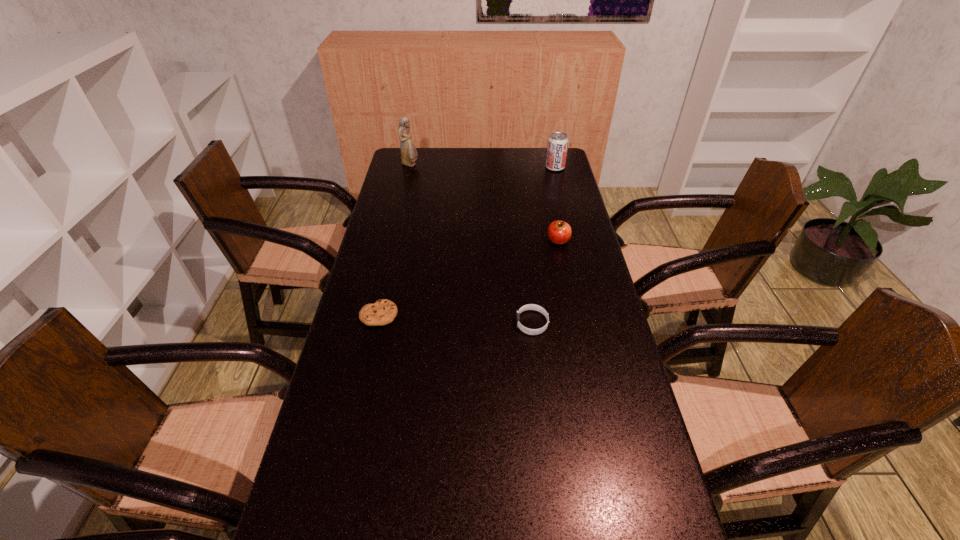
Identify the location of free spot between the cookie and the third tallest object. (468, 278).

The height and width of the screenshot is (540, 960). Find the location of `free area in between the third nearest object and the fourth shortest object`. free area in between the third nearest object and the fourth shortest object is located at coordinates (557, 204).

The height and width of the screenshot is (540, 960). In order to click on vacant point located between the second shortest object and the second tallest object in this screenshot , I will do `click(543, 245)`.

In order to click on free spot between the shortest object and the figurine in this screenshot , I will do `click(395, 240)`.

At what (x,y) coordinates should I click in order to perform the action: click on free spot between the tallest object and the cookie. Please return your answer as a coordinate pair (x, y). Looking at the image, I should click on (395, 240).

At what (x,y) coordinates should I click in order to perform the action: click on object that ranks as the second closest to the second shortest object. Please return your answer as a coordinate pair (x, y). This screenshot has width=960, height=540. Looking at the image, I should click on (382, 312).

Select which object appears as the third closest to the shortest object. Please provide its 2D coordinates. Your answer should be formatted as a tuple, i.e. [(x, y)], where the tuple contains the x and y coordinates of a point satisfying the conditions above.

[(409, 154)]

The width and height of the screenshot is (960, 540). I want to click on free space that satisfies the following two spatial constraints: 1. on the front-facing side of the figurine; 2. on the right side of the cookie, so click(375, 315).

Locate an element on the screen. vacant region that satisfies the following two spatial constraints: 1. on the front-facing side of the apple; 2. on the right side of the figurine is located at coordinates (393, 241).

I want to click on free spot that satisfies the following two spatial constraints: 1. on the front-facing side of the tallest object; 2. on the right side of the second tallest object, so click(410, 167).